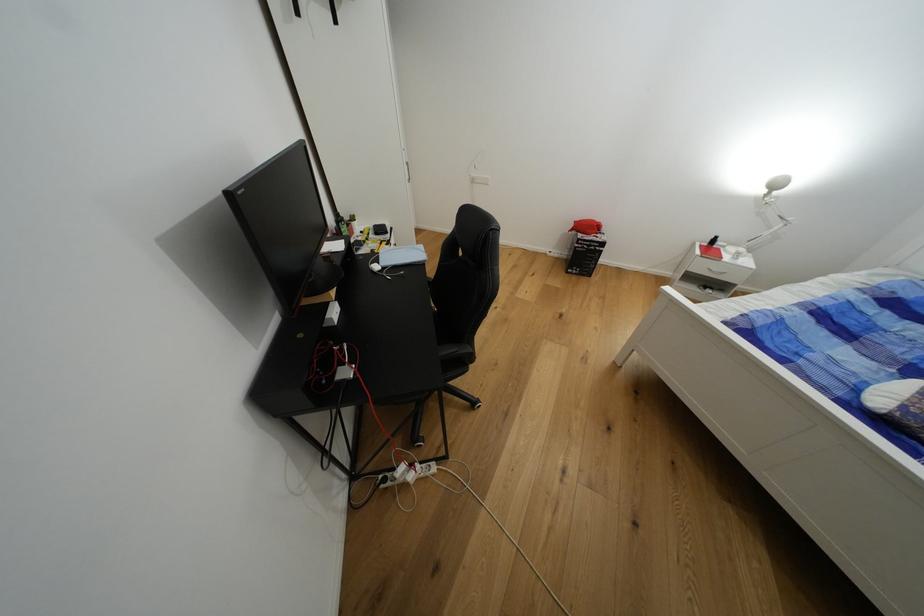
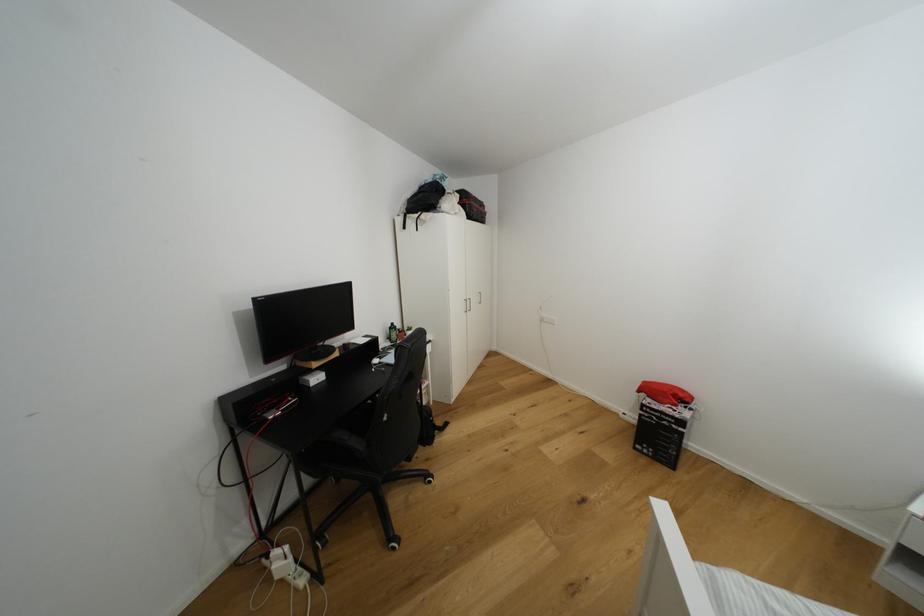
Locate, in the second image, the point that corresponds to (339,314) in the first image.

(322, 379)